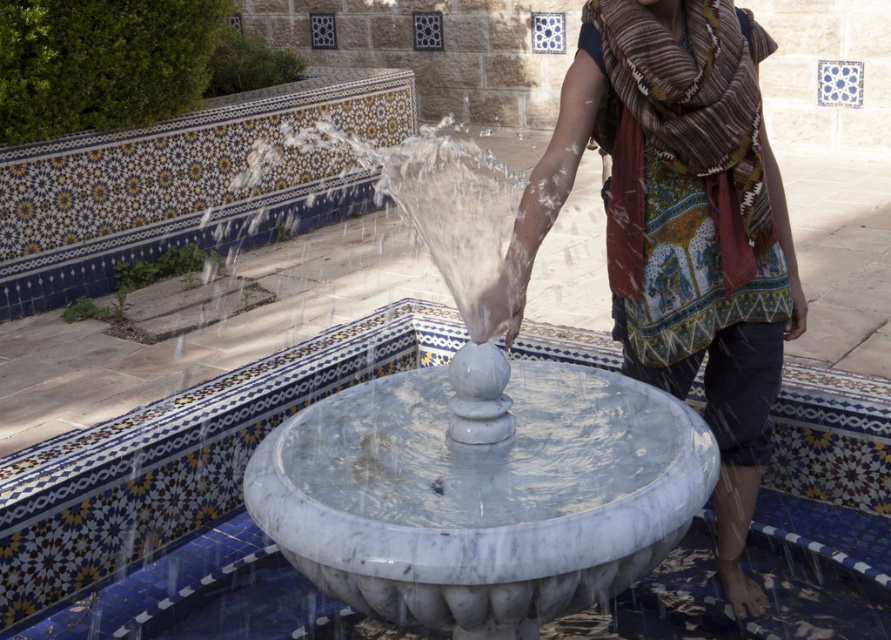
Who is lower down, white marble fountain at center or patterned scarf at center?

Positioned lower is white marble fountain at center.

What do you see at coordinates (481, 497) in the screenshot? The height and width of the screenshot is (640, 891). I see `white marble fountain at center` at bounding box center [481, 497].

Find the location of `white marble fountain at center`. white marble fountain at center is located at coordinates (481, 497).